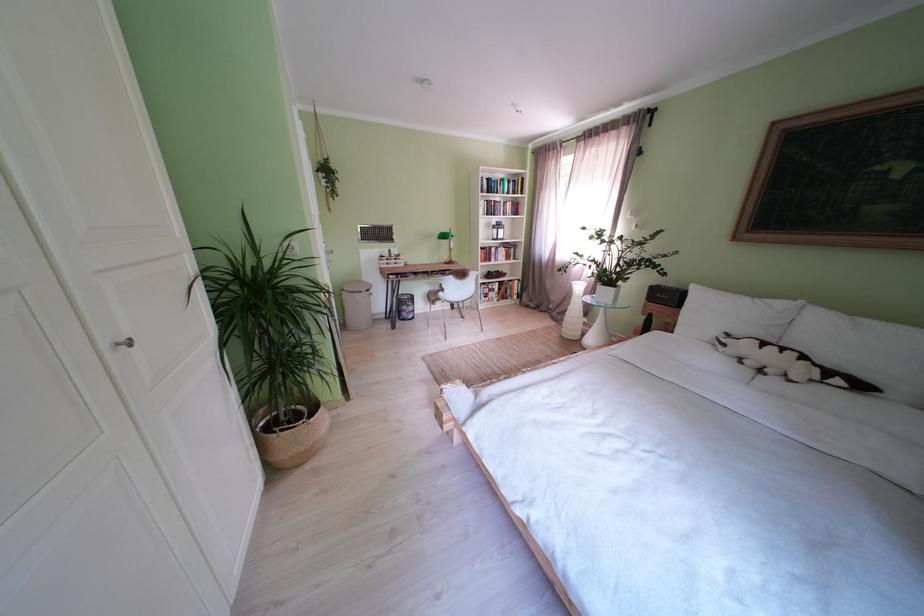
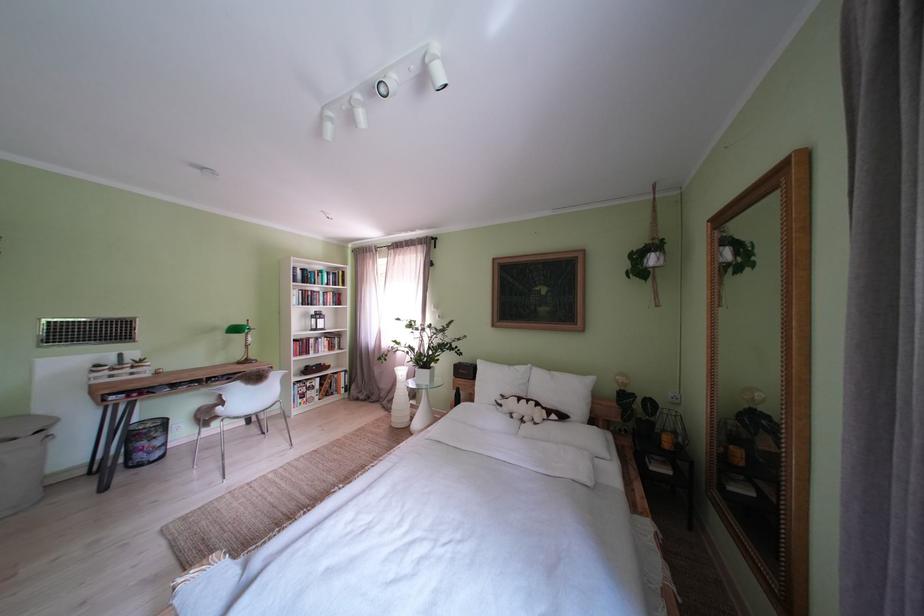
The first image is from the beginning of the video and the second image is from the end. How did the camera likely rotate when shooting the video?

The rotation direction of the camera is right-up.